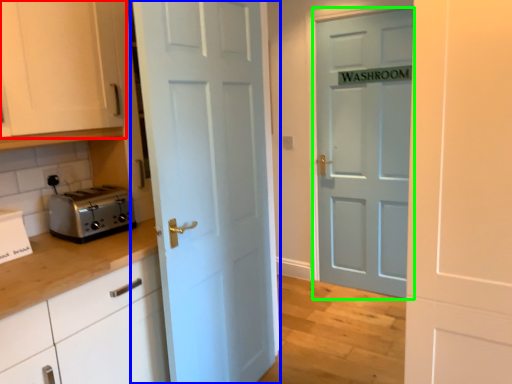
Question: Based on their relative distances, which object is nearer to cabinetry (highlighted by a red box)? Choose from door (highlighted by a blue box) and door (highlighted by a green box).

Choices:
 (A) door
 (B) door

Answer: (A)